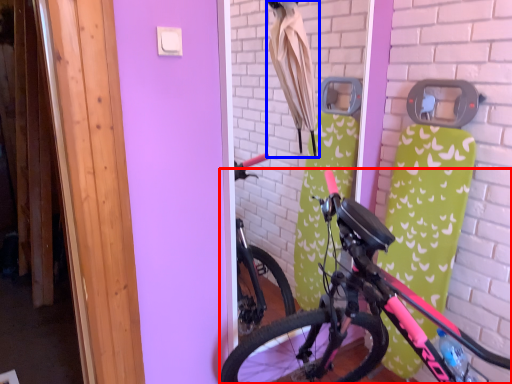
Question: Which object is closer to the camera taking this photo, bicycle (highlighted by a red box) or umbrella (highlighted by a blue box)?

Choices:
 (A) bicycle
 (B) umbrella

Answer: (A)